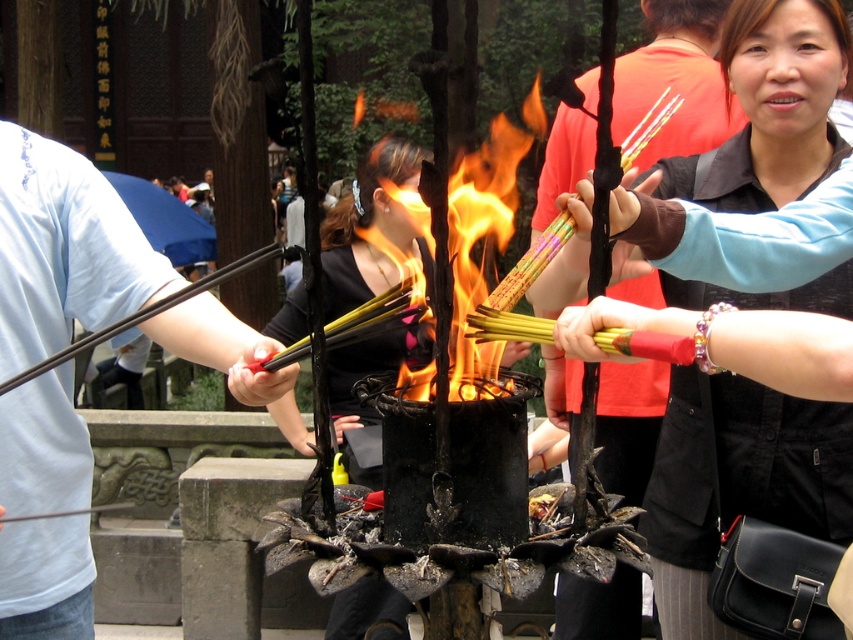
Based on the scene described, what object is located at the coordinates point (773, 106)?

The coordinates point (773, 106) corresponds to the matte black incense sticks at center.